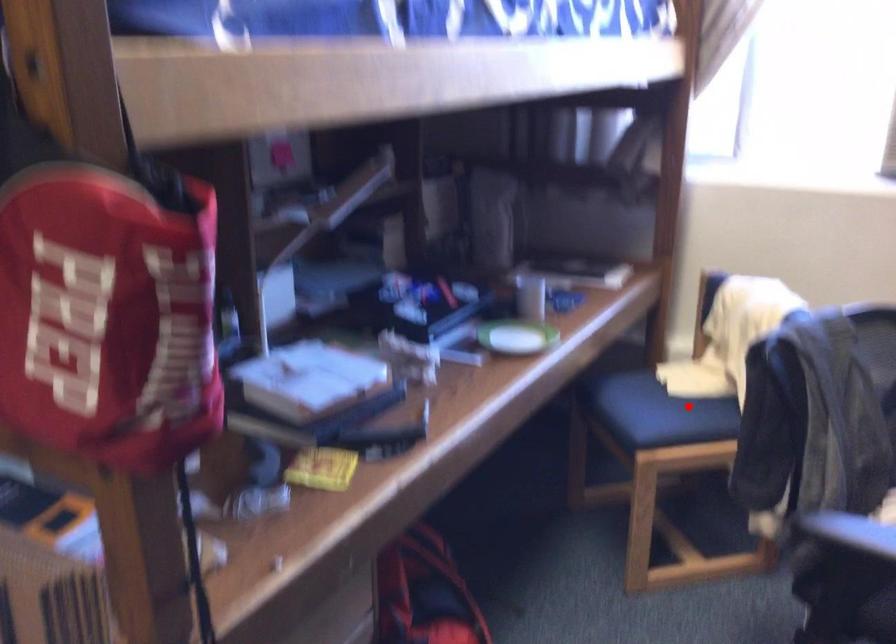
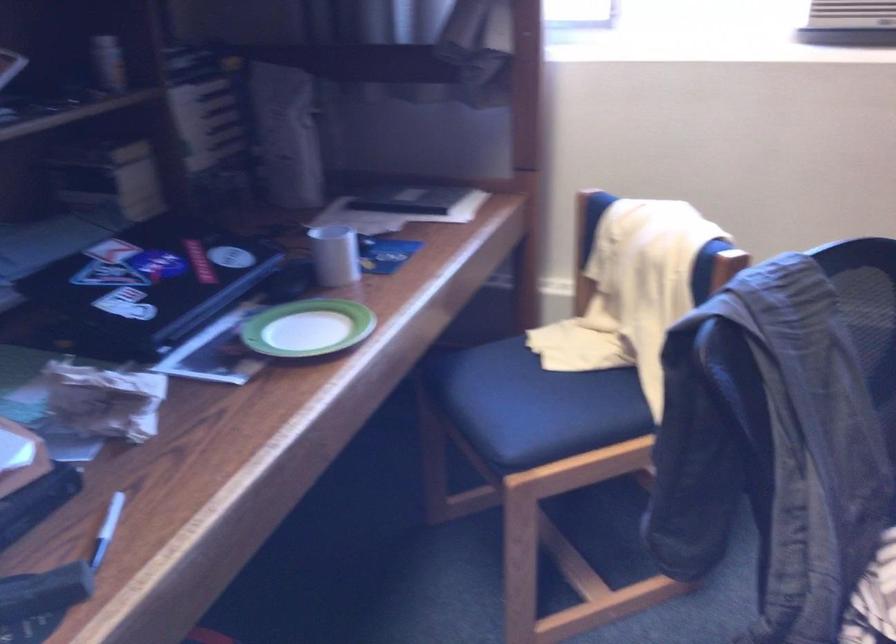
Question: I am providing you with two images of the same scene from different viewpoints. In image1, a red point is highlighted. Considering the same 3D point in image2, which of the following is correct?

Choices:
 (A) It is closer
 (B) It is farther

Answer: (A)